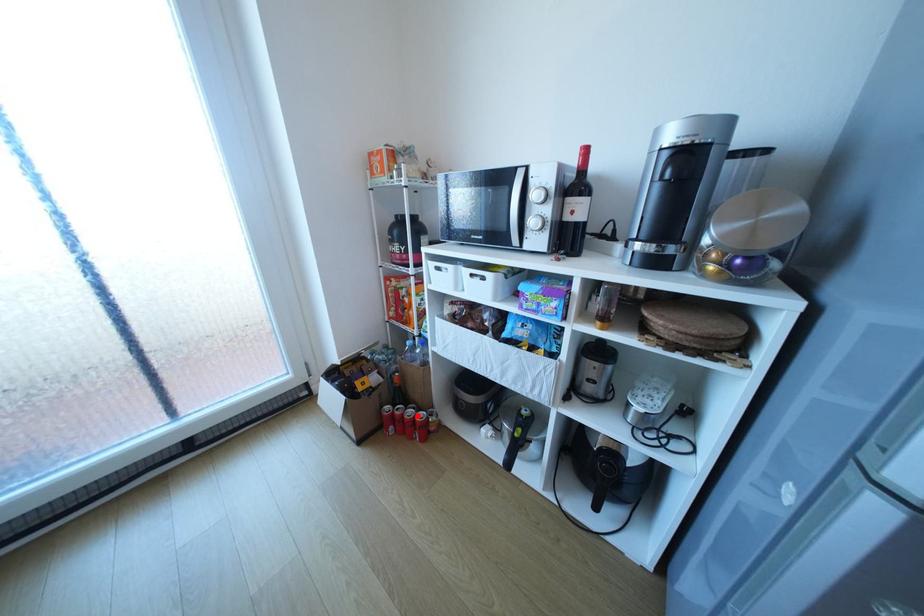
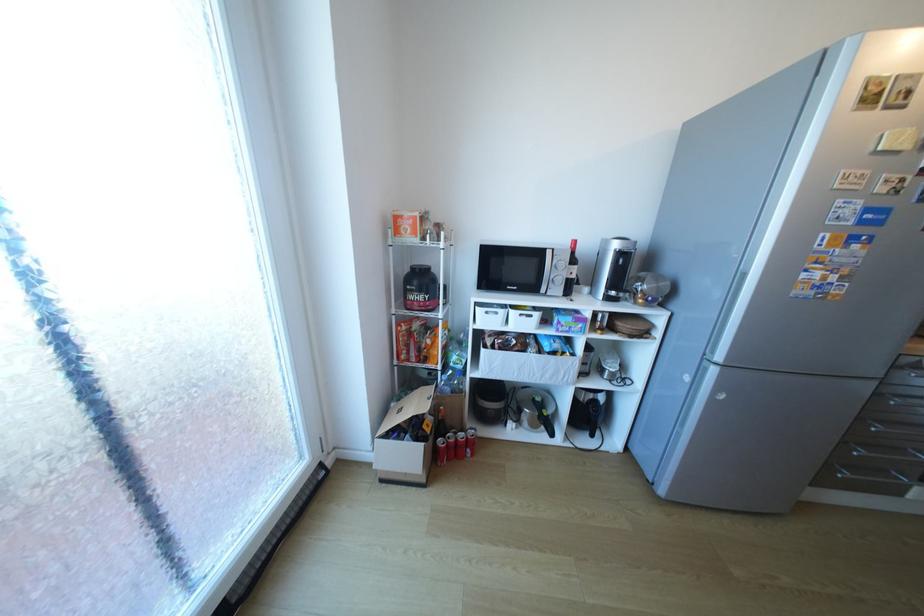
Find the pixel in the second image that matches the highlighted location in the first image.

(469, 439)